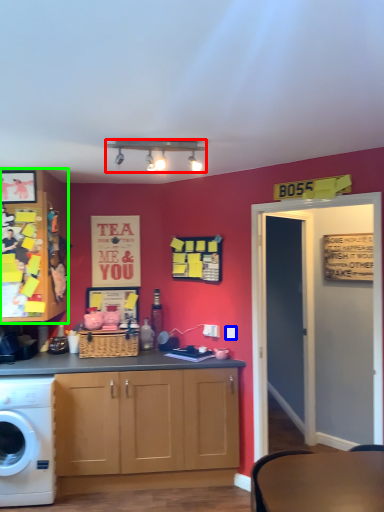
Question: Which object is the closest to the lamp (highlighted by a red box)? Choose among these: power outlet (highlighted by a blue box) or cabinetry (highlighted by a green box).

Choices:
 (A) power outlet
 (B) cabinetry

Answer: (B)